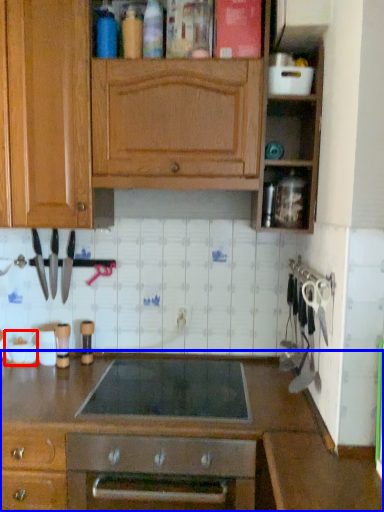
Question: Which point is closer to the camera, appliance (highlighted by a red box) or countertop (highlighted by a blue box)?

Choices:
 (A) appliance
 (B) countertop

Answer: (B)